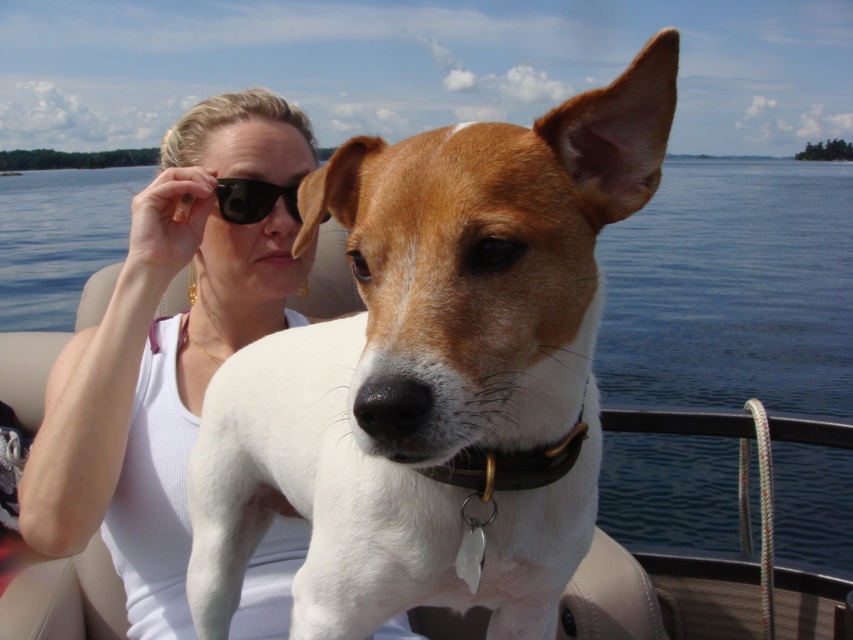
Question: Is white fur dog at center to the left of white fabric tank top at center from the viewer's perspective?

Choices:
 (A) yes
 (B) no

Answer: (B)

Question: Is blue water at center positioned before black plastic sunglasses at upper center?

Choices:
 (A) no
 (B) yes

Answer: (B)

Question: Which object appears closest to the camera in this image?

Choices:
 (A) blue water at center
 (B) black plastic sunglasses at upper center
 (C) white fur dog at center

Answer: (C)

Question: Among these objects, which one is farthest from the camera?

Choices:
 (A) black plastic sunglasses at upper center
 (B) white fabric tank top at center

Answer: (A)

Question: Which object appears closest to the camera in this image?

Choices:
 (A) blue water at center
 (B) white fabric tank top at center
 (C) white fur dog at center

Answer: (C)

Question: From the image, what is the correct spatial relationship of white fur dog at center in relation to blue water at center?

Choices:
 (A) right
 (B) left

Answer: (A)